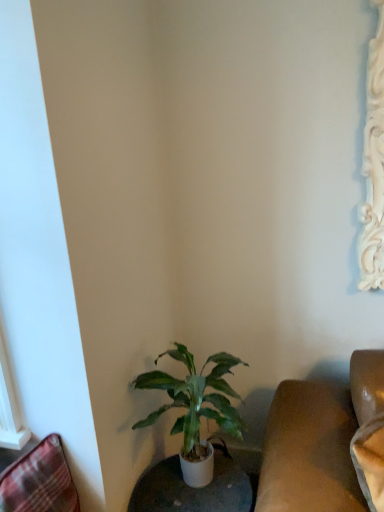
Question: Is plaid fabric swivel chair at lower left oriented towards green matte plant at lower center?

Choices:
 (A) yes
 (B) no

Answer: (B)

Question: Is plaid fabric swivel chair at lower left not near green matte plant at lower center?

Choices:
 (A) yes
 (B) no

Answer: (B)

Question: Is green matte plant at lower center at the back of plaid fabric swivel chair at lower left?

Choices:
 (A) no
 (B) yes

Answer: (A)

Question: Can you confirm if plaid fabric swivel chair at lower left is wider than green matte plant at lower center?

Choices:
 (A) yes
 (B) no

Answer: (B)

Question: Is the position of plaid fabric swivel chair at lower left more distant than that of green matte plant at lower center?

Choices:
 (A) no
 (B) yes

Answer: (A)

Question: From the image's perspective, is green matte plant at lower center located above or below plaid fabric swivel chair at lower left?

Choices:
 (A) below
 (B) above

Answer: (B)

Question: In terms of width, does green matte plant at lower center look wider or thinner when compared to plaid fabric swivel chair at lower left?

Choices:
 (A) wide
 (B) thin

Answer: (A)

Question: Which is correct: green matte plant at lower center is inside plaid fabric swivel chair at lower left, or outside of it?

Choices:
 (A) inside
 (B) outside

Answer: (B)

Question: From a real-world perspective, is green matte plant at lower center above or below plaid fabric swivel chair at lower left?

Choices:
 (A) above
 (B) below

Answer: (A)

Question: Would you say plaid fabric swivel chair at lower left is to the left or to the right of white glossy round table at lower center in the picture?

Choices:
 (A) right
 (B) left

Answer: (B)

Question: From the image's perspective, relative to white glossy round table at lower center, is plaid fabric swivel chair at lower left above or below?

Choices:
 (A) below
 (B) above

Answer: (B)

Question: Is plaid fabric swivel chair at lower left taller or shorter than white glossy round table at lower center?

Choices:
 (A) short
 (B) tall

Answer: (A)

Question: Looking at their shapes, would you say plaid fabric swivel chair at lower left is wider or thinner than white glossy round table at lower center?

Choices:
 (A) thin
 (B) wide

Answer: (A)

Question: Is point (236, 498) positioned closer to the camera than point (172, 428)?

Choices:
 (A) closer
 (B) farther

Answer: (B)

Question: From a real-world perspective, is white glossy round table at lower center physically located above or below green matte plant at lower center?

Choices:
 (A) below
 (B) above

Answer: (A)